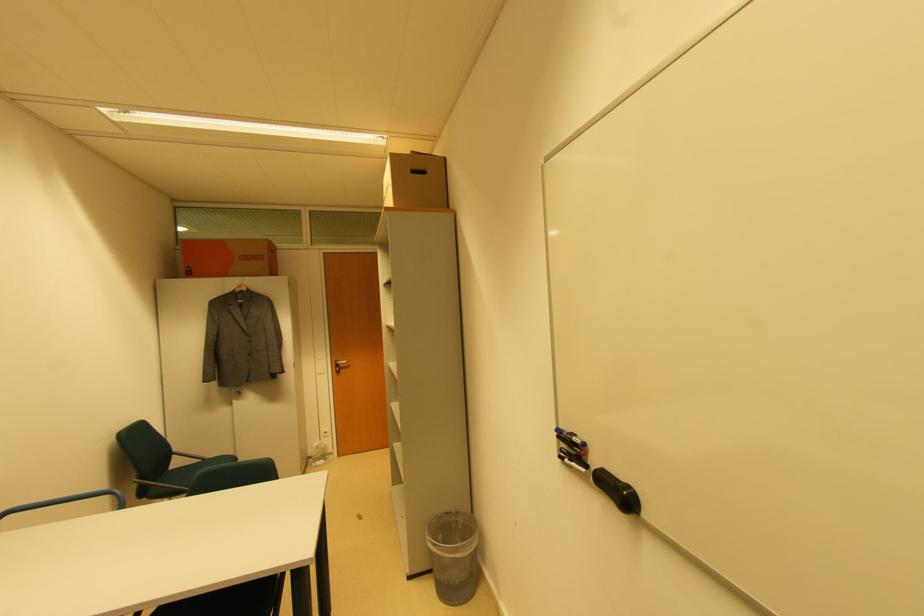
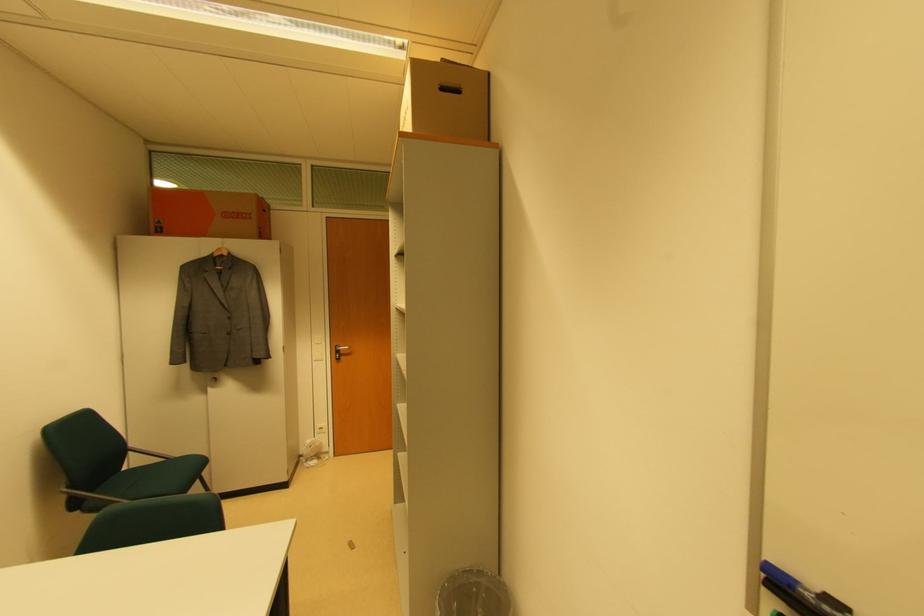
Where in the second image is the point corresponding to point (239, 395) from the first image?

(216, 382)